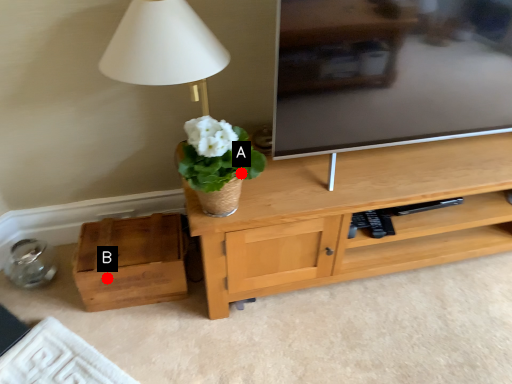
Question: Two points are circled on the image, labeled by A and B beside each circle. Among these points, which one is nearest to the camera?

Choices:
 (A) A is closer
 (B) B is closer

Answer: (A)